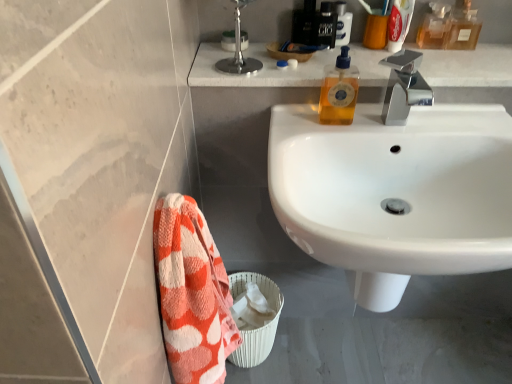
In order to click on vacant area on the back side of polished chrome faucet at upper right in this screenshot , I will do `click(250, 46)`.